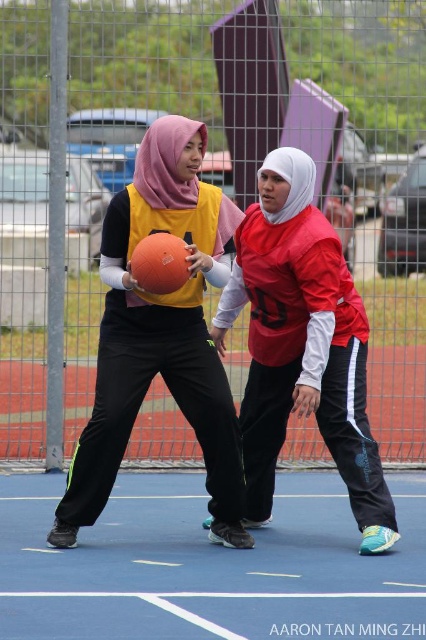
You are a referee observing a dodgeball match. You notice the matte orange basketball at center and the matte red jersey at center. Which object is positioned higher in the image?

The matte orange basketball at center is located above the matte red jersey at center, so it is positioned higher in the image.